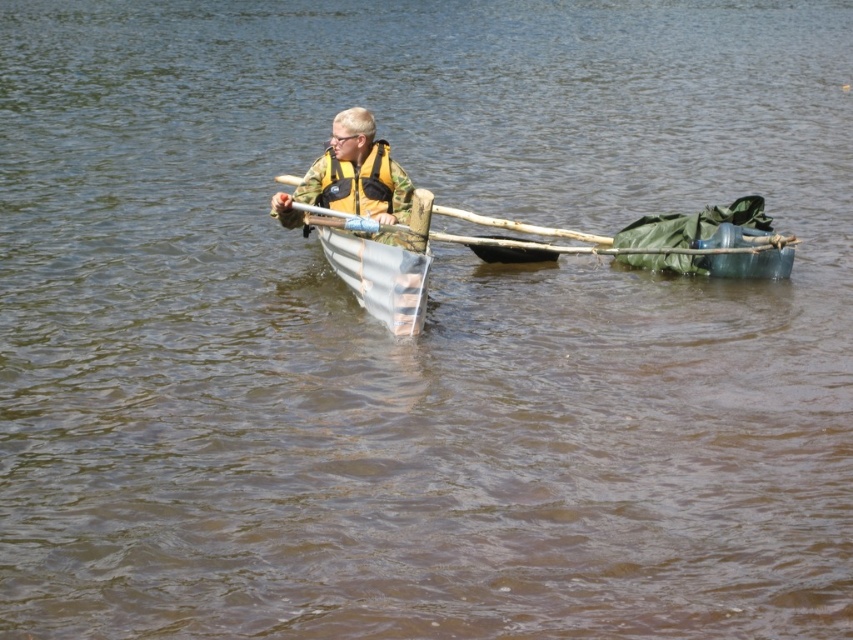
Looking at this image, the person in the image is wearing a camouflage fabric jacket at center and a yellow fabric life jacket at center. Which piece of clothing is taller?

The camouflage fabric jacket at center is much taller than the yellow fabric life jacket at center.

Based on the scene description, where is the camouflage fabric jacket at center located in the image?

The camouflage fabric jacket at center is located at the 2D coordinate point of (351, 177).